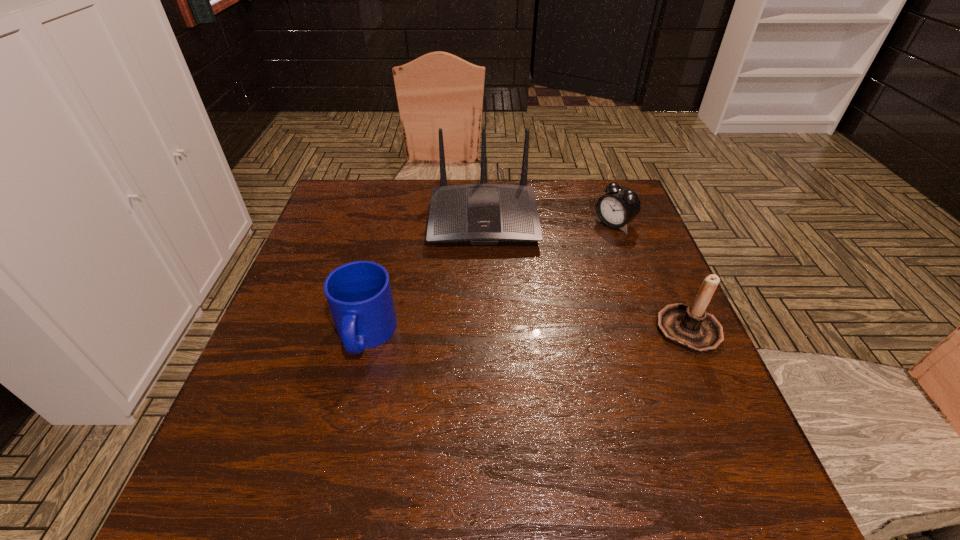
You are a GUI agent. You are given a task and a screenshot of the screen. Output one action in this format:
    pyautogui.click(x=<x>, y=<y>)
    Task: Click on the vacant spot on the desktop that is between the mug and the third shortest object and is positioned on the front-facing side of the second object from left to right
    Image resolution: width=960 pixels, height=540 pixels.
    Given the screenshot: What is the action you would take?
    pyautogui.click(x=487, y=333)

At what (x,y) coordinates should I click in order to perform the action: click on vacant spot on the desktop that is between the mug and the candle holder and is positioned on the front side of the alarm clock. Please return your answer as a coordinate pair (x, y). Looking at the image, I should click on pyautogui.click(x=481, y=333).